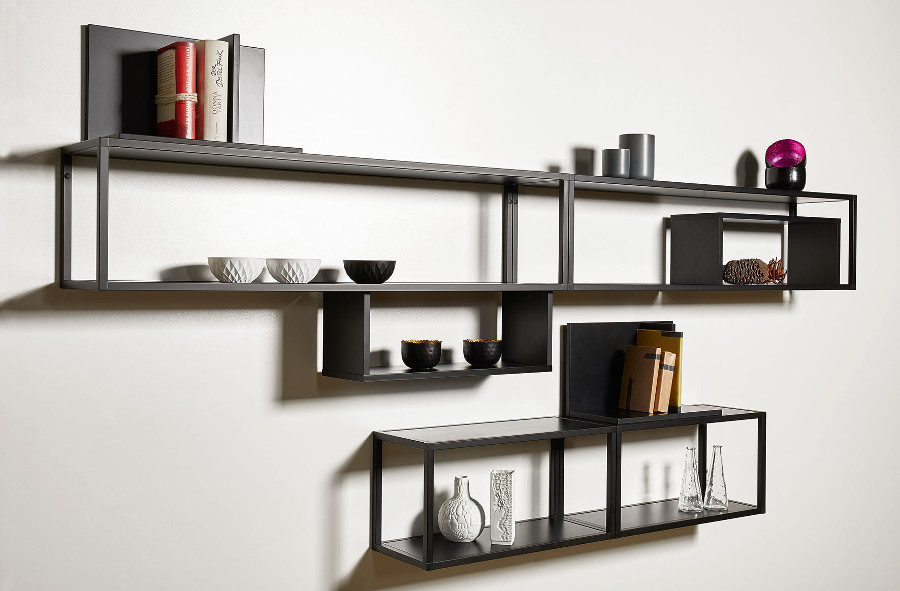
Identify the location of books. The image size is (900, 591). (191, 100), (211, 95), (234, 108), (648, 383), (654, 397), (664, 400), (676, 389).